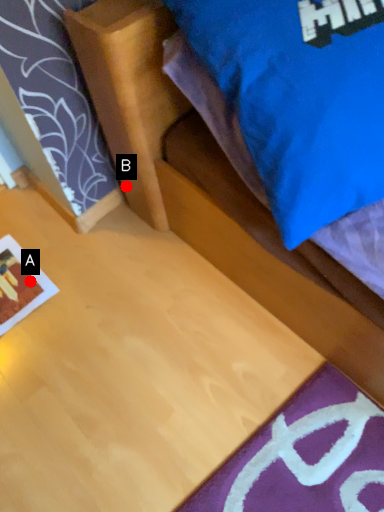
Question: Two points are circled on the image, labeled by A and B beside each circle. Among these points, which one is nearest to the camera?

Choices:
 (A) A is closer
 (B) B is closer

Answer: (B)